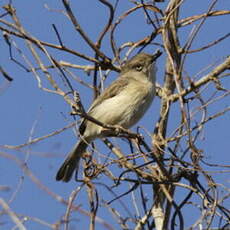
This screenshot has height=230, width=230. In order to click on chest in this screenshot , I will do `click(142, 108)`.